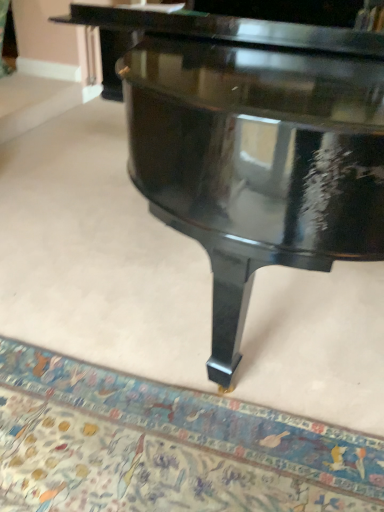
Question: Considering the positions of glossy black piano at center and carpet with intricate patterns at lower center in the image, is glossy black piano at center taller or shorter than carpet with intricate patterns at lower center?

Choices:
 (A) tall
 (B) short

Answer: (A)

Question: Considering the positions of glossy black piano at center and carpet with intricate patterns at lower center in the image, is glossy black piano at center wider or thinner than carpet with intricate patterns at lower center?

Choices:
 (A) thin
 (B) wide

Answer: (B)

Question: Is glossy black piano at center bigger or smaller than carpet with intricate patterns at lower center?

Choices:
 (A) small
 (B) big

Answer: (B)

Question: Considering their positions, is carpet with intricate patterns at lower center located in front of or behind glossy black piano at center?

Choices:
 (A) behind
 (B) front

Answer: (A)

Question: In terms of size, does carpet with intricate patterns at lower center appear bigger or smaller than glossy black piano at center?

Choices:
 (A) small
 (B) big

Answer: (A)

Question: Considering the positions of carpet with intricate patterns at lower center and glossy black piano at center in the image, is carpet with intricate patterns at lower center taller or shorter than glossy black piano at center?

Choices:
 (A) short
 (B) tall

Answer: (A)

Question: From the image's perspective, is carpet with intricate patterns at lower center located above or below glossy black piano at center?

Choices:
 (A) below
 (B) above

Answer: (A)